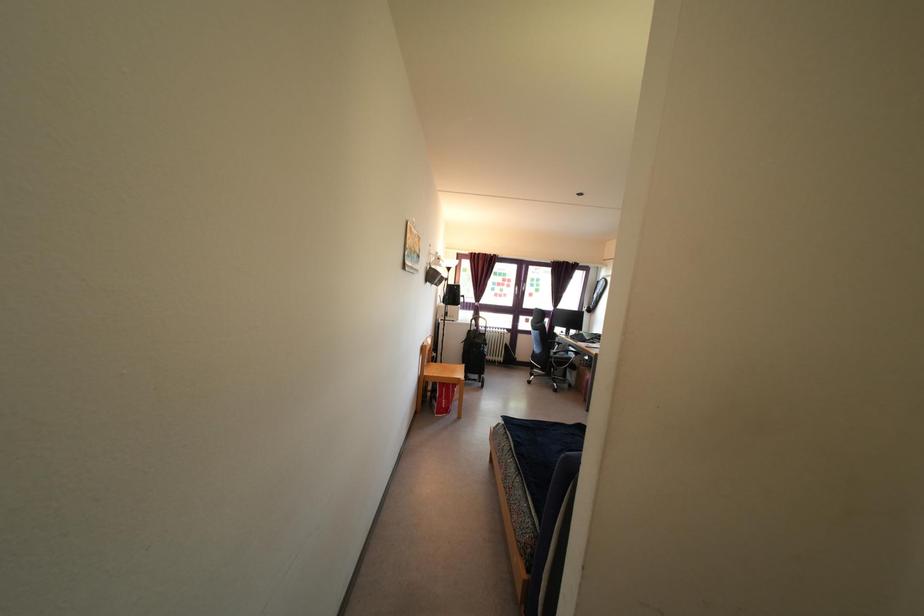
Which object does [444,398] point to?

It corresponds to the red bag in the image.